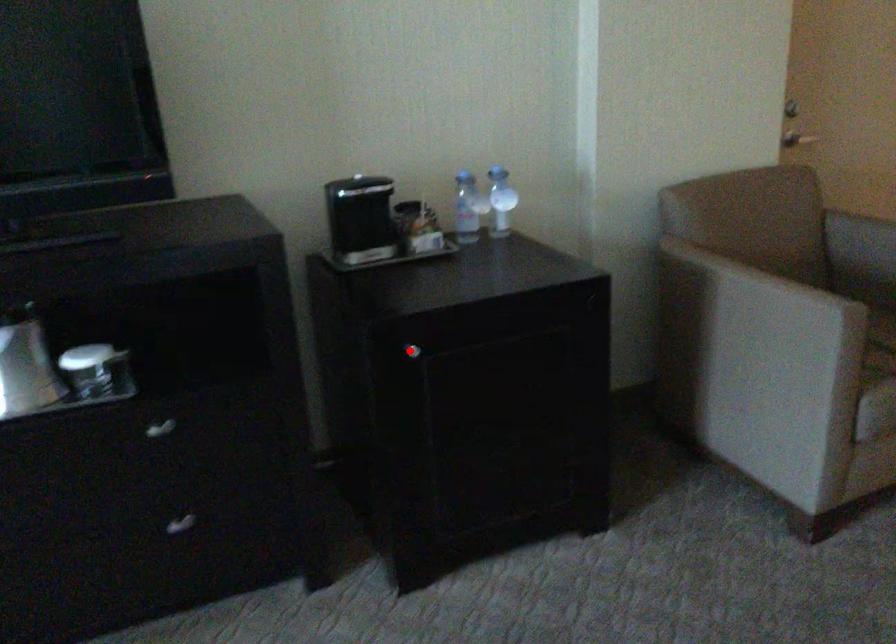
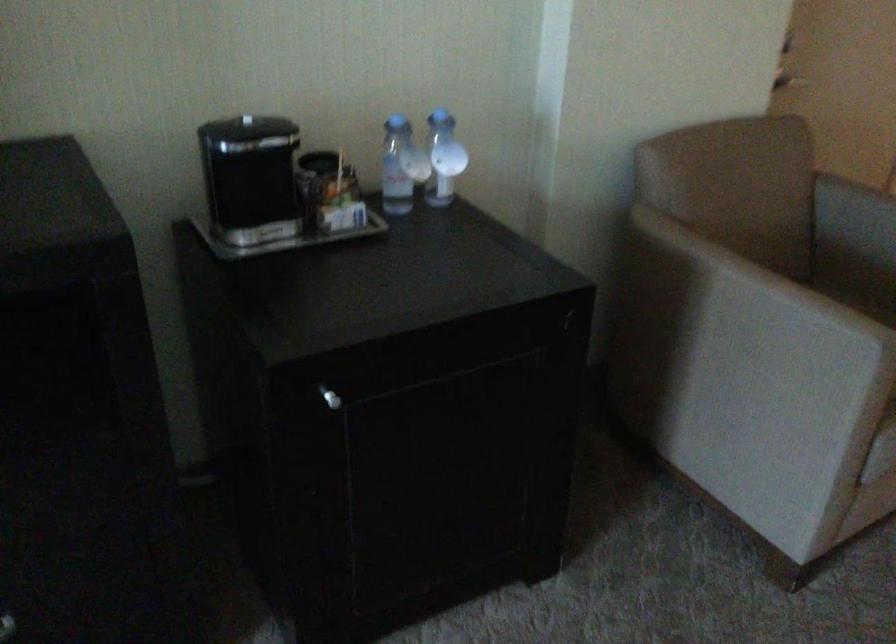
Locate, in the second image, the point that corresponds to the highlighted location in the first image.

(330, 398)